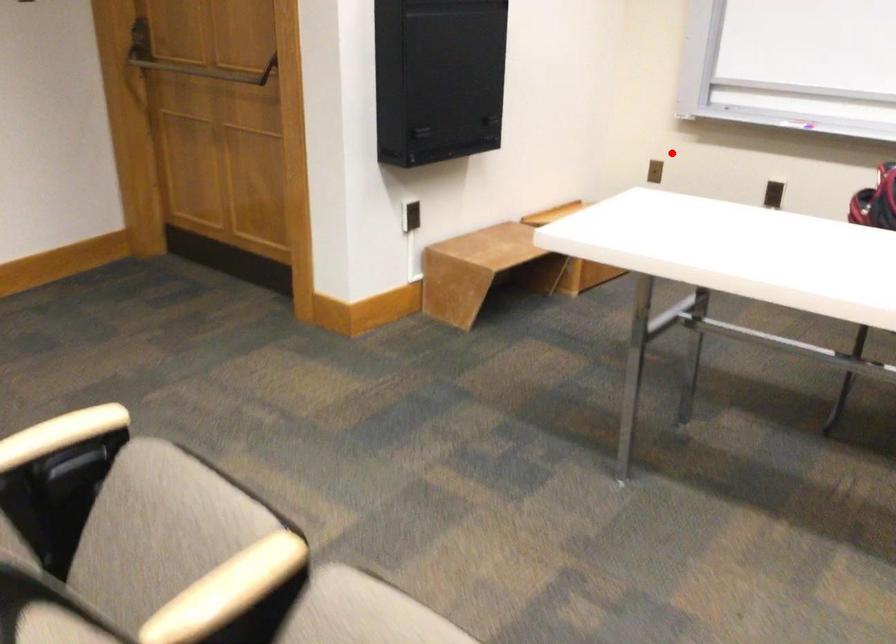
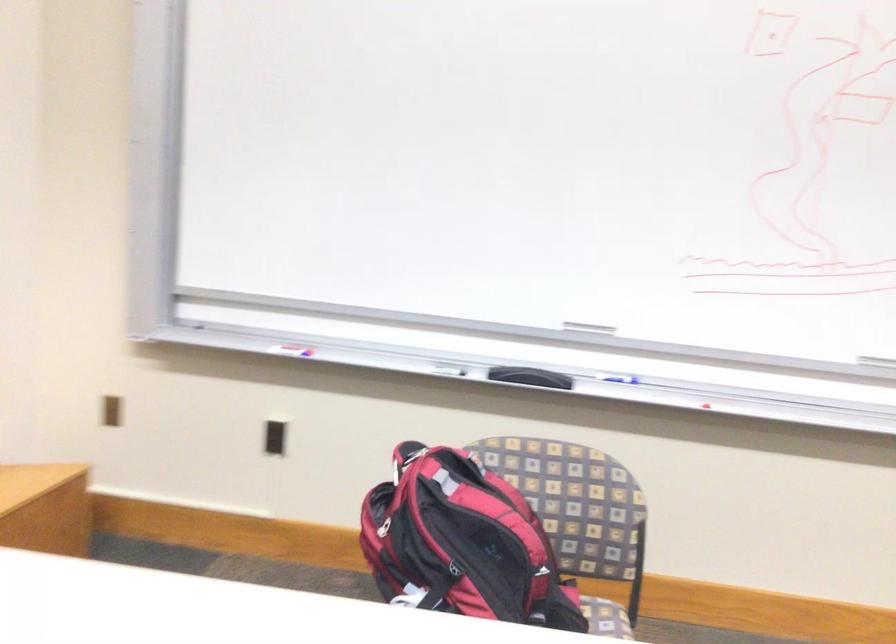
The point at the highlighted location is marked in the first image. Where is the corresponding point in the second image?

(112, 410)